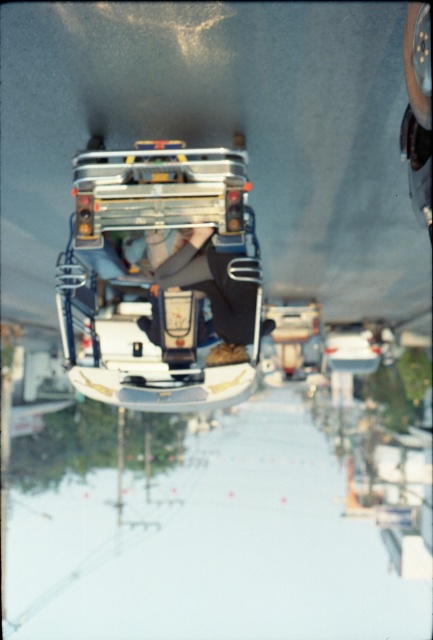
Is metallic silver ski lift at center thinner than leather black pants at center?

In fact, metallic silver ski lift at center might be wider than leather black pants at center.

Can you confirm if metallic silver ski lift at center is smaller than leather black pants at center?

Incorrect, metallic silver ski lift at center is not smaller in size than leather black pants at center.

You are a GUI agent. You are given a task and a screenshot of the screen. Output one action in this format:
    pyautogui.click(x=<x>, y=<y>)
    Task: Click on the metallic silver ski lift at center
    The image size is (433, 640).
    Given the screenshot: What is the action you would take?
    pyautogui.click(x=162, y=275)